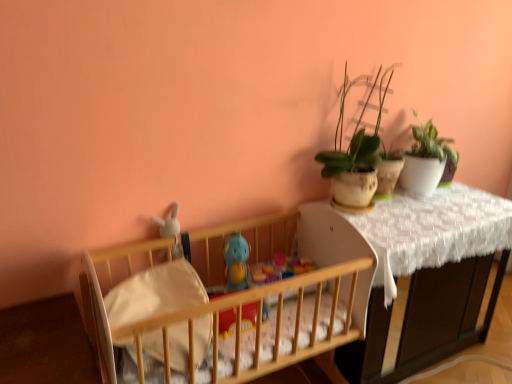
Locate an element on the screen. vacant area that lies in front of matte clay pot at upper right, the first houseplant positioned from the left is located at coordinates (380, 226).